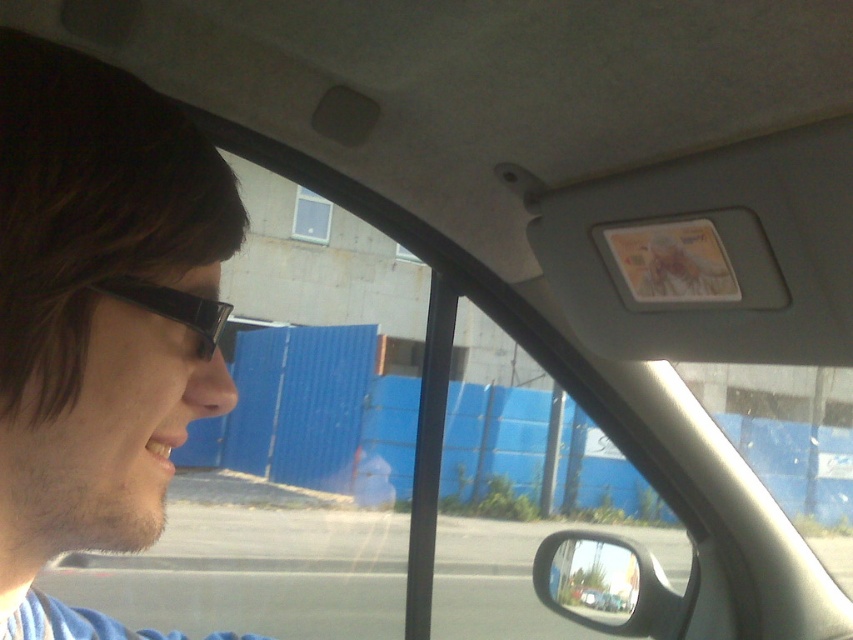
You are a passenger in the car and want to check your reflection in the glossy black side mirror at lower right. However, the brown matte hair at upper left is blocking your view. Can you see your reflection in the mirror?

The brown matte hair at upper left is in front of the glossy black side mirror at lower right, so it is blocking the mirror. Therefore, you cannot see your reflection in the glossy black side mirror at lower right.

You are a passenger in the car and want to describe the driver to the police. You see the brown matte hair at upper left and the black plastic glasses at left. Which one is more to the left?

The brown matte hair at upper left is more to the left than the black plastic glasses at left.

You are a delivery robot standing 5 feet away from the camera. You need to pick up a package from the glossy black side mirror at lower right. Can you reach it?

The glossy black side mirror at lower right is 6.64 feet from camera. Since you are 5 feet away from the camera, the total distance between you and the glossy black side mirror at lower right is 11.64 feet. Therefore, you cannot reach it.